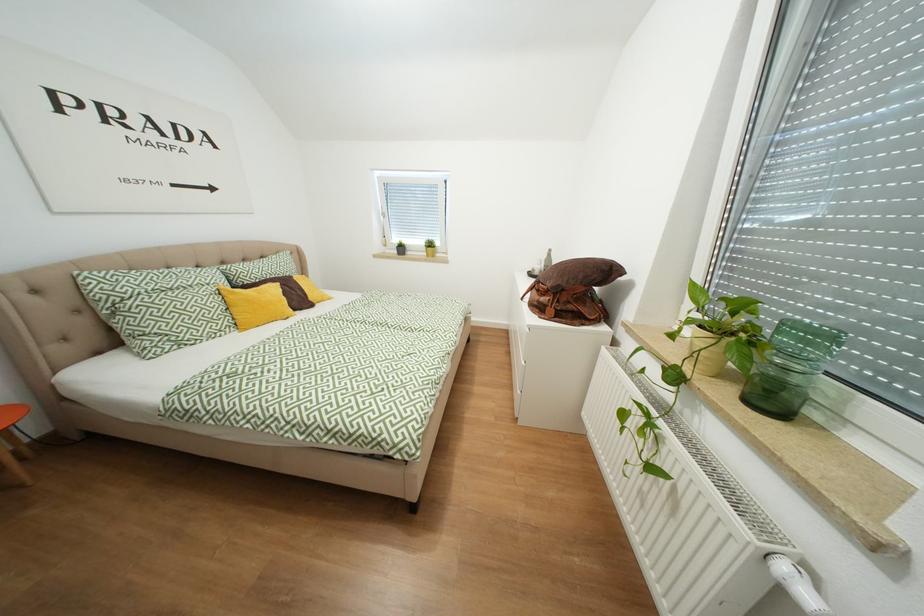
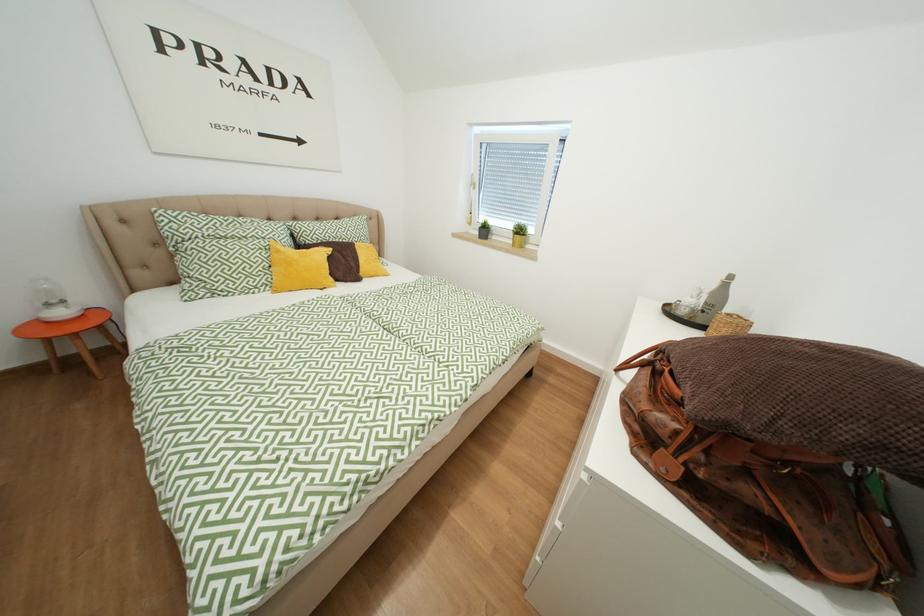
Question: In a continuous first-person perspective shot, in which direction is the camera moving?

Choices:
 (A) Left
 (B) Right
 (C) Forward
 (D) Backward

Answer: (C)